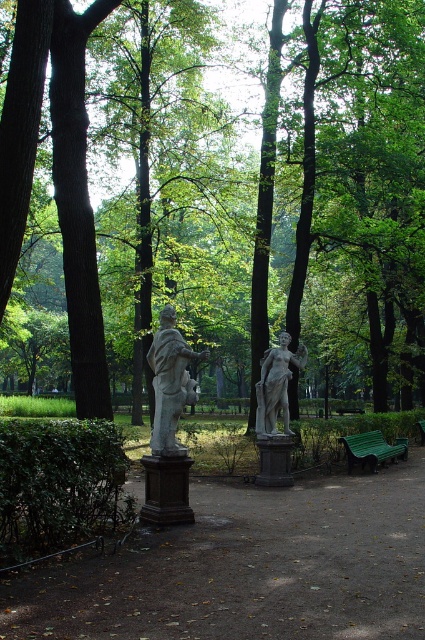
You are a park visitor who wants to take a break. You see the gray stone statue at center and the green painted wood bench at lower right. Which one can you sit on?

The green painted wood bench at lower right is the one you can sit on because it is a bench designed for sitting, while the gray stone statue at center is a statue meant for display and not for sitting.

From the picture: You are planning to install a new bench in the park between the brown wood tree at center and the white marble statue at center. The bench requires a minimum of 40 feet of space between them to fit properly. Based on the scene description, will there be enough space for the bench?

The distance between the brown wood tree at center and the white marble statue at center is 50.02 feet, which exceeds the required 40 feet. Therefore, there is sufficient space to install the bench between them.

You are standing at the entrance of the park and want to locate two specific points marked in the image. Which of the two points, point 1 at coordinates (107, 412) or point 2 at (280, 390), is closer to you?

Point 1 at coordinates (107, 412) is closer to you because it is further to the viewer than point 2 at (280, 390).